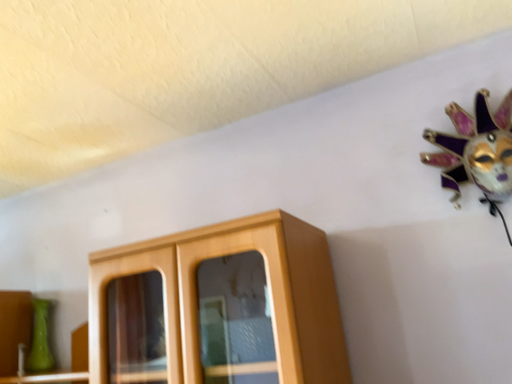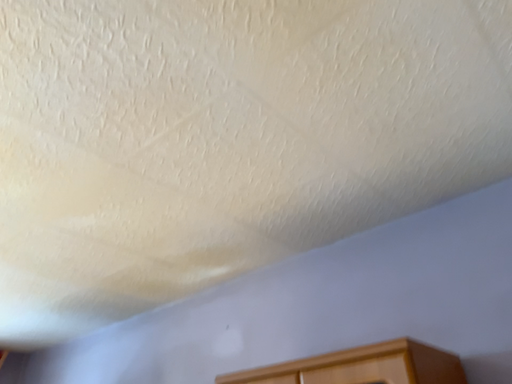
Question: How did the camera likely rotate when shooting the video?

Choices:
 (A) rotated left
 (B) rotated right

Answer: (A)